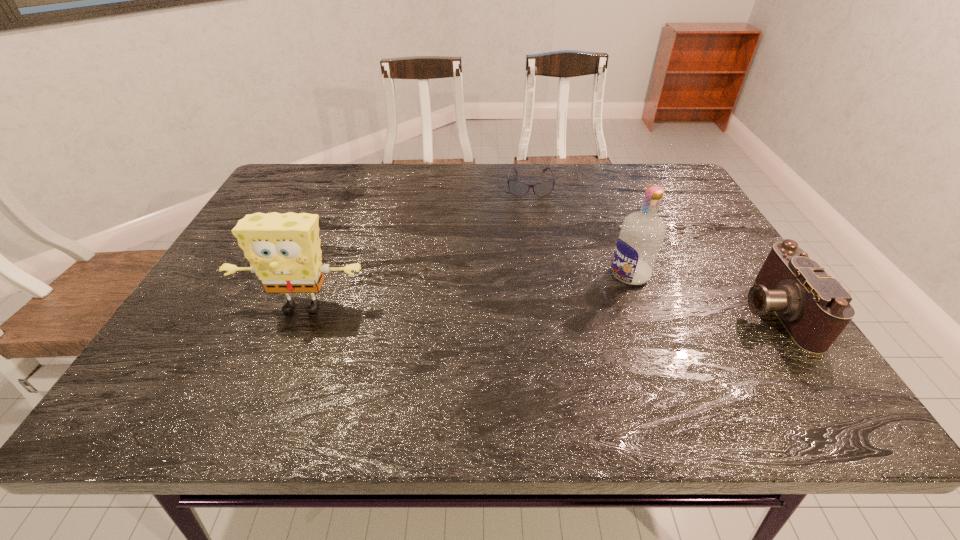
The image size is (960, 540). I want to click on vacant area between the sponge and the rightmost object, so click(538, 309).

I want to click on vacant point located between the leftmost object and the shortest object, so click(x=416, y=246).

Image resolution: width=960 pixels, height=540 pixels. I want to click on vacant space that is in between the second object from left to right and the vodka, so click(x=580, y=230).

Where is `vacant region between the sunglasses and the leftmost object`? This screenshot has height=540, width=960. vacant region between the sunglasses and the leftmost object is located at coordinates (416, 246).

This screenshot has width=960, height=540. Identify the location of vacant space that is in between the sunglasses and the leftmost object. (416, 246).

Identify which object is located as the second nearest to the camera. Please provide its 2D coordinates. Your answer should be formatted as a tuple, i.e. [(x, y)], where the tuple contains the x and y coordinates of a point satisfying the conditions above.

[(518, 188)]

Identify which object is the third nearest to the camera. Please provide its 2D coordinates. Your answer should be formatted as a tuple, i.e. [(x, y)], where the tuple contains the x and y coordinates of a point satisfying the conditions above.

[(284, 251)]

Where is `vacant space that satisfies the following two spatial constraints: 1. on the face of the sponge; 2. on the front-facing side of the camera`? The image size is (960, 540). vacant space that satisfies the following two spatial constraints: 1. on the face of the sponge; 2. on the front-facing side of the camera is located at coordinates (300, 311).

Locate an element on the screen. vacant area that satisfies the following two spatial constraints: 1. on the front side of the sunglasses; 2. on the right side of the second object from right to left is located at coordinates (544, 274).

Locate an element on the screen. free space that satisfies the following two spatial constraints: 1. on the face of the rightmost object; 2. on the front-facing side of the leftmost object is located at coordinates (300, 311).